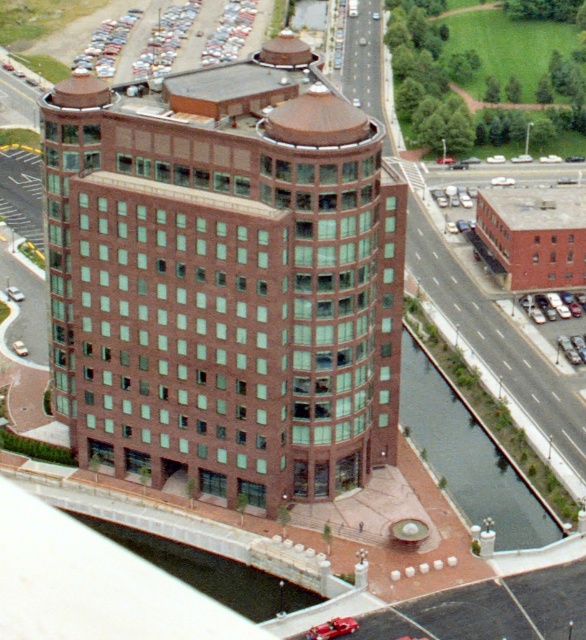
You are standing at the point marked by coordinates point [224,280] in the image. What is the primary material of the building located at that point?

The point [224,280] marks the brown brick building at center, so the primary material is brown brick.

You are standing in front of the modern multi story building with curved facade. You see a point marked at coordinates (224,280). What part of the building is this point located on?

Result: The point at coordinates (224,280) is located on the brown brick building at center.

In the scene shown: You are standing in front of the brown brick building at center and want to take a photo of the metallic silver car at right. Since the building is blocking your view, can you move to the left to capture the car without the building in the frame?

The brown brick building at center is in front of the metallic silver car at right, so moving to the left might allow you to capture the car without the building blocking the view.